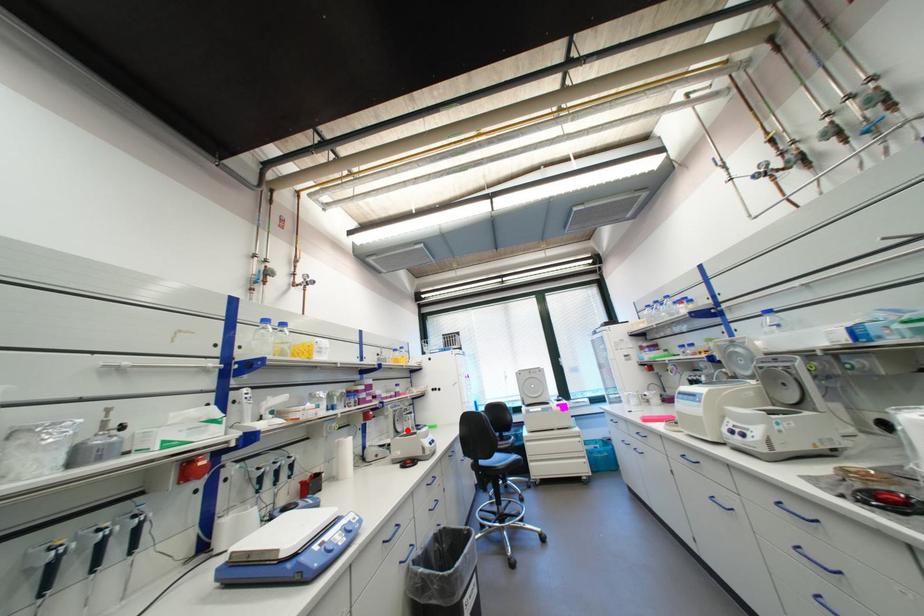
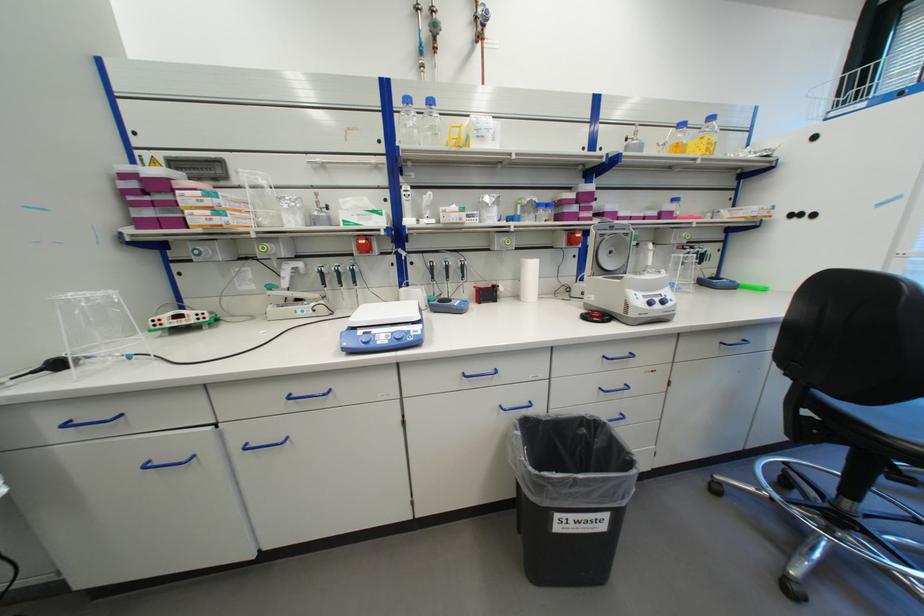
Where in the second image is the point corresponding to the highlighted location from the first image?

(616, 267)